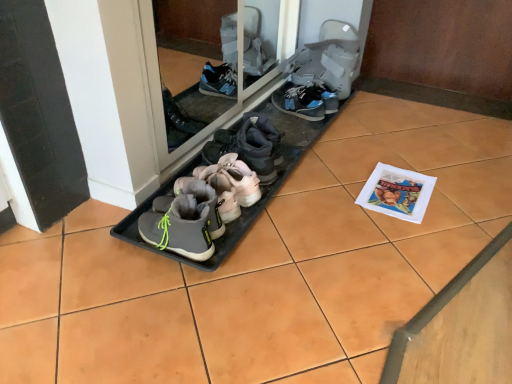
Measure the distance between point [285,92] and camera.

Point [285,92] and camera are 6.31 feet apart from each other.

Measure the distance between point (389, 202) and camera.

1.40 meters.

At what (x,y) coordinates should I click in order to perform the action: click on gray fabric boot at center, acting as the 7th footwear starting from the front. Please return your answer as a coordinate pair (x, y). The image size is (512, 384). Looking at the image, I should click on (321, 73).

Find the location of a particular element. gray fabric sneakers at center, positioned as the fourth footwear in front-to-back order is located at coordinates (232, 179).

The image size is (512, 384). What are the coordinates of `transparent glass door at center` in the screenshot? It's located at (211, 64).

Is gray fabric sneakers at center, positioned as the 4th footwear in back-to-front order, completely or partially inside gray suede boot at center, which is counted as the 3th footwear, starting from the front?

No.

Is gray suede boot at center, which appears as the fifth footwear when viewed from the back, at the left side of gray fabric sneakers at center, positioned as the 4th footwear in back-to-front order?

Yes.

Is gray suede boot at center, which appears as the fifth footwear when viewed from the back, oriented away from gray fabric sneakers at center, positioned as the fourth footwear in front-to-back order?

gray suede boot at center, which appears as the fifth footwear when viewed from the back, does not have its back to gray fabric sneakers at center, positioned as the fourth footwear in front-to-back order.

From the picture: Does gray suede boot at center, which appears as the fifth footwear when viewed from the back, have a greater width compared to gray fabric sneakers at center, positioned as the 4th footwear in back-to-front order?

Incorrect, the width of gray suede boot at center, which appears as the fifth footwear when viewed from the back, does not surpass that of gray fabric sneakers at center, positioned as the 4th footwear in back-to-front order.

Is transparent glass door at center not inside gray rubber boots at center, which appears as the 2th footwear when viewed from the front?

transparent glass door at center is positioned outside gray rubber boots at center, which appears as the 2th footwear when viewed from the front.

Does transparent glass door at center turn towards gray rubber boots at center, which appears as the sixth footwear when viewed from the back?

Yes, transparent glass door at center is turned towards gray rubber boots at center, which appears as the sixth footwear when viewed from the back.

Could you measure the distance between transparent glass door at center and gray rubber boots at center, which appears as the sixth footwear when viewed from the back?

The distance of transparent glass door at center from gray rubber boots at center, which appears as the sixth footwear when viewed from the back, is 22.18 inches.

Locate an element on the screen. The image size is (512, 384). glass door that is behind the gray rubber boots at center, which appears as the sixth footwear when viewed from the back is located at coordinates (211, 64).

Find the location of a particular element. The width and height of the screenshot is (512, 384). the 3rd footwear to the left of the gray fabric boot at center, which is the first footwear in back-to-front order, starting your count from the anchor is located at coordinates (232, 179).

Is gray fabric boot at center, which is the first footwear in back-to-front order, touching gray fabric sneakers at center, positioned as the 4th footwear in back-to-front order?

No, gray fabric boot at center, which is the first footwear in back-to-front order, is not beside gray fabric sneakers at center, positioned as the 4th footwear in back-to-front order.

Which is closer to the camera, (x=338, y=56) or (x=233, y=190)?

The point (x=233, y=190) is closer.

Is gray fabric boot at center, which is the first footwear in back-to-front order, smaller than gray fabric sneakers at center, positioned as the 4th footwear in back-to-front order?

No.

Considering the sizes of objects white paper magazine at upper right and gray suede sneaker at center, positioned as the sixth footwear in front-to-back order, in the image provided, who is taller, white paper magazine at upper right or gray suede sneaker at center, positioned as the sixth footwear in front-to-back order,?

With more height is gray suede sneaker at center, positioned as the sixth footwear in front-to-back order.

From the image's perspective, which is above, white paper magazine at upper right or gray suede sneaker at center, which appears as the second footwear when viewed from the back?

From the image's view, gray suede sneaker at center, which appears as the second footwear when viewed from the back, is above.

How different are the orientations of white paper magazine at upper right and gray suede sneaker at center, which appears as the second footwear when viewed from the back, in degrees?

109 degrees.

Is white paper magazine at upper right located outside gray suede sneaker at center, positioned as the sixth footwear in front-to-back order?

Indeed, white paper magazine at upper right is completely outside gray suede sneaker at center, positioned as the sixth footwear in front-to-back order.

Looking at this image, which is more to the right, gray suede booties at center, acting as the seventh footwear starting from the back, or gray suede sneaker at center, positioned as the sixth footwear in front-to-back order?

From the viewer's perspective, gray suede sneaker at center, positioned as the sixth footwear in front-to-back order, appears more on the right side.

Which of these two, gray suede booties at center, acting as the 1th footwear starting from the front, or gray suede sneaker at center, positioned as the sixth footwear in front-to-back order, is wider?

gray suede sneaker at center, positioned as the sixth footwear in front-to-back order.

Are gray suede booties at center, acting as the seventh footwear starting from the back, and gray suede sneaker at center, which appears as the second footwear when viewed from the back, far apart?

They are positioned close to each other.

Considering the points (199, 227) and (309, 113), which point is behind, point (199, 227) or point (309, 113)?

The point (309, 113) is farther from the camera.

Is gray rubber boots at center, which appears as the sixth footwear when viewed from the back, oriented away from white paper magazine at upper right?

No, gray rubber boots at center, which appears as the sixth footwear when viewed from the back,'s orientation is not away from white paper magazine at upper right.

Is white paper magazine at upper right inside gray rubber boots at center, which appears as the sixth footwear when viewed from the back?

No, gray rubber boots at center, which appears as the sixth footwear when viewed from the back, does not contain white paper magazine at upper right.

Is the position of gray rubber boots at center, which appears as the 2th footwear when viewed from the front, more distant than that of white paper magazine at upper right?

No, gray rubber boots at center, which appears as the 2th footwear when viewed from the front, is closer to the viewer.

In the image, is gray suede booties at center, acting as the 1th footwear starting from the front, positioned in front of or behind gray suede sneakers at center, positioned as the third footwear in back-to-front order?

Visually, gray suede booties at center, acting as the 1th footwear starting from the front, is located in front of gray suede sneakers at center, positioned as the third footwear in back-to-front order.

From their relative heights in the image, would you say gray suede booties at center, acting as the 1th footwear starting from the front, is taller or shorter than gray suede sneakers at center, positioned as the third footwear in back-to-front order?

Considering their sizes, gray suede booties at center, acting as the 1th footwear starting from the front, has less height than gray suede sneakers at center, positioned as the third footwear in back-to-front order.

Is point (173, 217) positioned before point (238, 136)?

That is True.

Where is `footwear that is the 2nd object to the left of the gray fabric sneakers at center, positioned as the fourth footwear in front-to-back order, starting at the anchor`? The image size is (512, 384). footwear that is the 2nd object to the left of the gray fabric sneakers at center, positioned as the fourth footwear in front-to-back order, starting at the anchor is located at coordinates (202, 201).

From a real-world perspective, which footwear is the 7th one underneath the transparent glass door at center? Please provide its 2D coordinates.

[(200, 209)]

Considering their positions, is gray suede boot at center, which appears as the fifth footwear when viewed from the back, positioned further to gray rubber boots at center, which appears as the 2th footwear when viewed from the front, than transparent glass door at center?

Among the two, transparent glass door at center is located further to gray rubber boots at center, which appears as the 2th footwear when viewed from the front.

Considering their positions, is gray fabric sneakers at center, positioned as the 4th footwear in back-to-front order, positioned closer to gray suede booties at center, acting as the 1th footwear starting from the front, than white paper magazine at upper right?

Based on the image, gray fabric sneakers at center, positioned as the 4th footwear in back-to-front order, appears to be nearer to gray suede booties at center, acting as the 1th footwear starting from the front.

From the image, which object appears to be nearer to gray suede booties at center, acting as the 1th footwear starting from the front, white paper magazine at upper right or gray fabric boot at center, acting as the 7th footwear starting from the front?

white paper magazine at upper right lies closer to gray suede booties at center, acting as the 1th footwear starting from the front, than the other object.

Which object lies further to the anchor point transparent glass door at center, gray fabric sneakers at center, positioned as the fourth footwear in front-to-back order, or gray fabric boot at center, which is the first footwear in back-to-front order?

Among the two, gray fabric sneakers at center, positioned as the fourth footwear in front-to-back order, is located further to transparent glass door at center.

Based on their spatial positions, is gray suede sneaker at center, positioned as the sixth footwear in front-to-back order, or gray suede sneakers at center, the 5th footwear positioned from the front, closer to white paper magazine at upper right?

The object closer to white paper magazine at upper right is gray suede sneakers at center, the 5th footwear positioned from the front.

When comparing their distances from gray fabric boot at center, acting as the 7th footwear starting from the front, does transparent glass door at center or gray suede sneakers at center, positioned as the third footwear in back-to-front order, seem closer?

transparent glass door at center lies closer to gray fabric boot at center, acting as the 7th footwear starting from the front, than the other object.

When comparing their distances from gray fabric sneakers at center, positioned as the fourth footwear in front-to-back order, does gray suede booties at center, acting as the seventh footwear starting from the back, or gray fabric boot at center, which is the first footwear in back-to-front order, seem closer?

gray suede booties at center, acting as the seventh footwear starting from the back, lies closer to gray fabric sneakers at center, positioned as the fourth footwear in front-to-back order, than the other object.

Estimate the real-world distances between objects in this image. Which object is further from transparent glass door at center, gray suede boot at center, which is counted as the 3th footwear, starting from the front, or gray suede sneaker at center, positioned as the sixth footwear in front-to-back order?

Among the two, gray suede boot at center, which is counted as the 3th footwear, starting from the front, is located further to transparent glass door at center.

Identify the location of glass door between gray fabric boot at center, acting as the 7th footwear starting from the front, and white paper magazine at upper right, in the vertical direction. This screenshot has height=384, width=512. (211, 64).

Identify the location of footwear located between gray suede sneakers at center, positioned as the third footwear in back-to-front order, and gray fabric boot at center, which is the first footwear in back-to-front order, in the depth direction. This screenshot has width=512, height=384. (306, 101).

Where is `magazine between gray rubber boots at center, which appears as the sixth footwear when viewed from the back, and gray suede sneaker at center, which appears as the second footwear when viewed from the back, along the z-axis`? The height and width of the screenshot is (384, 512). magazine between gray rubber boots at center, which appears as the sixth footwear when viewed from the back, and gray suede sneaker at center, which appears as the second footwear when viewed from the back, along the z-axis is located at coordinates (397, 193).

At what (x,y) coordinates should I click in order to perform the action: click on glass door between gray suede booties at center, acting as the 1th footwear starting from the front, and gray fabric boot at center, acting as the 7th footwear starting from the front, along the z-axis. Please return your answer as a coordinate pair (x, y). The height and width of the screenshot is (384, 512). Looking at the image, I should click on (211, 64).